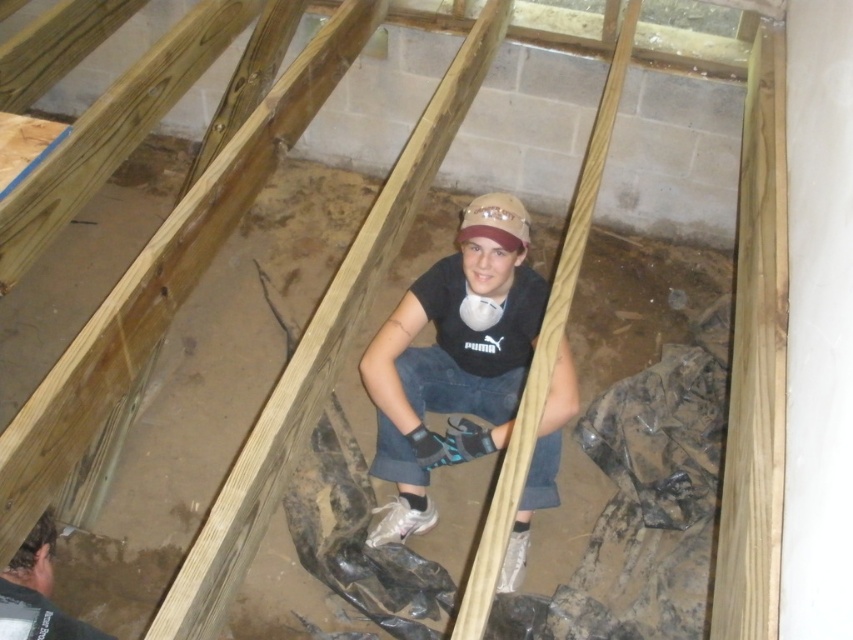
Question: Which point is closer to the camera?

Choices:
 (A) matte black gloves at lower left
 (B) black matte t-shirt at center

Answer: (A)

Question: Is black matte t-shirt at center above matte black gloves at lower left?

Choices:
 (A) yes
 (B) no

Answer: (A)

Question: Is black matte t-shirt at center to the left of matte black gloves at lower left from the viewer's perspective?

Choices:
 (A) yes
 (B) no

Answer: (B)

Question: Is black matte t-shirt at center to the left of matte black gloves at lower left from the viewer's perspective?

Choices:
 (A) no
 (B) yes

Answer: (A)